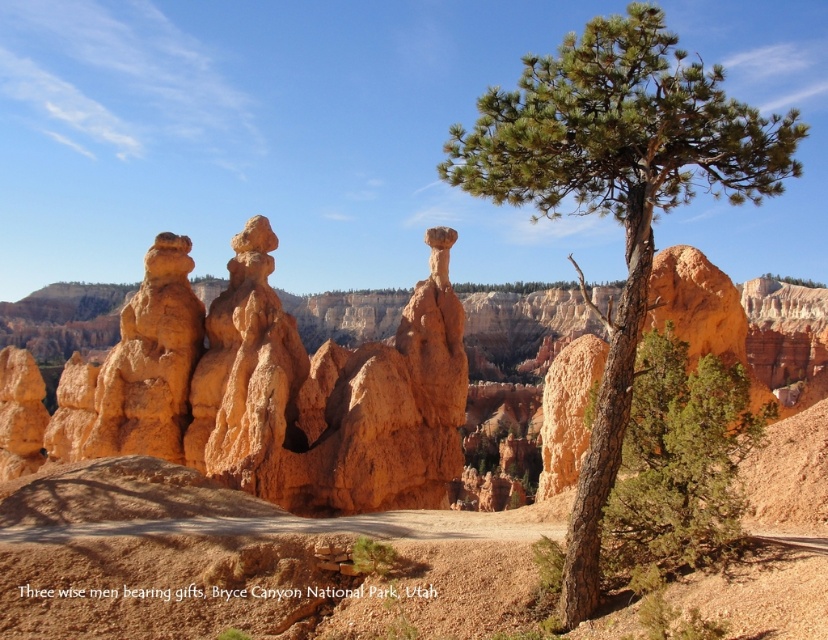
You are a hiker planning to take a photo of the orange sandstone hoodoo at center and the green rough bark tree at center. Which object should you focus on first if you want to capture both in a single frame without moving the camera?

You should focus on the green rough bark tree at center first because it is larger than the orange sandstone hoodoo at center, ensuring it fits well within the frame before adjusting for the smaller hoodoo.

You are a photographer planning to capture the orange sandstone hoodoo at center and the green textured tree at center in a single frame. Based on their positions, which object would appear closer to the camera in the photo?

The orange sandstone hoodoo at center appears closer to the camera because it is positioned below the green textured tree at center, indicating it is lower in the frame and thus nearer to the viewer.

You are a photographer planning to capture the orange sandstone hoodoo at center and the green rough bark tree at center in a single frame. Which object should you position to the left side of your camera frame to ensure both are included?

The orange sandstone hoodoo at center is already positioned on the left side of the green rough bark tree at center. To include both in your frame, position the orange sandstone hoodoo at center to the left side of your camera frame so that the green rough bark tree at center is on the right side.